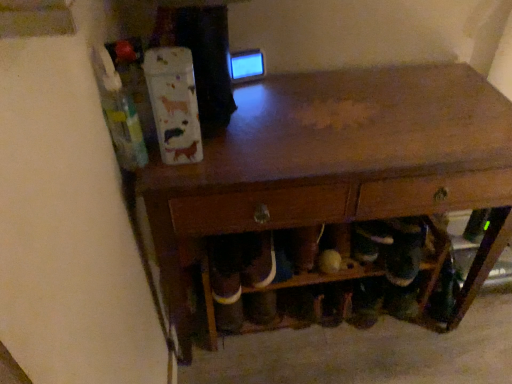
What do you see at coordinates (434, 258) in the screenshot?
I see `wooden shoe rack at lower center` at bounding box center [434, 258].

What is the approximate height of wooden shoe rack at lower center?

wooden shoe rack at lower center is 16.55 inches tall.

At what (x,y) coordinates should I click in order to perform the action: click on wooden shoe rack at lower center. Please return your answer as a coordinate pair (x, y). This screenshot has height=384, width=512. Looking at the image, I should click on (434, 258).

Describe the element at coordinates (339, 164) in the screenshot. I see `wooden table at center` at that location.

What is the approximate width of wooden table at center?

19.31 inches.

At what (x,y) coordinates should I click in order to perform the action: click on wooden table at center. Please return your answer as a coordinate pair (x, y). Looking at the image, I should click on (339, 164).

Locate an element on the screen. This screenshot has height=384, width=512. wooden shoe rack at lower center is located at coordinates (434, 258).

Looking at this image, does wooden table at center appear on the left side of wooden shoe rack at lower center?

In fact, wooden table at center is to the right of wooden shoe rack at lower center.

Is wooden table at center in front of or behind wooden shoe rack at lower center in the image?

Visually, wooden table at center is located in front of wooden shoe rack at lower center.

Between point (503, 233) and point (251, 291), which one is positioned behind?

Point (251, 291)

From the image's perspective, is wooden table at center positioned above or below wooden shoe rack at lower center?

Clearly, from the image's perspective, wooden table at center is above wooden shoe rack at lower center.

From a real-world perspective, is wooden table at center located beneath wooden shoe rack at lower center?

Actually, wooden table at center is physically above wooden shoe rack at lower center in the real world.

Looking at this image, considering the sizes of objects wooden table at center and wooden shoe rack at lower center in the image provided, who is wider, wooden table at center or wooden shoe rack at lower center?

Wider between the two is wooden table at center.

Which of these two, wooden table at center or wooden shoe rack at lower center, stands shorter?

Standing shorter between the two is wooden shoe rack at lower center.

Does wooden table at center have a larger size compared to wooden shoe rack at lower center?

Yes.

Is wooden table at center completely or partially outside of wooden shoe rack at lower center?

No, wooden table at center is inside or overlapping with wooden shoe rack at lower center.

Is wooden table at center with wooden shoe rack at lower center?

There is a gap between wooden table at center and wooden shoe rack at lower center.

Is wooden table at center facing towards wooden shoe rack at lower center?

Yes, wooden table at center is facing wooden shoe rack at lower center.

Can you tell me how much wooden table at center and wooden shoe rack at lower center differ in facing direction?

They differ by 1.96 degrees in their facing directions.

Measure the distance between wooden table at center and wooden shoe rack at lower center.

31.65 centimeters.

I want to click on shelf located underneath the wooden table at center (from a real-world perspective), so click(434, 258).

Does wooden shoe rack at lower center appear on the left side of wooden table at center?

Correct, you'll find wooden shoe rack at lower center to the left of wooden table at center.

In the image, is wooden shoe rack at lower center positioned in front of or behind wooden table at center?

wooden shoe rack at lower center is positioned farther from the viewer than wooden table at center.

Which is closer to the camera, (212, 346) or (468, 147)?

The point (468, 147) is in front.

From the image's perspective, is wooden shoe rack at lower center above or below wooden table at center?

Based on their image positions, wooden shoe rack at lower center is located beneath wooden table at center.

From a real-world perspective, is wooden shoe rack at lower center positioned under wooden table at center based on gravity?

Yes.

Is wooden shoe rack at lower center wider than wooden table at center?

In fact, wooden shoe rack at lower center might be narrower than wooden table at center.

Is wooden shoe rack at lower center taller or shorter than wooden table at center?

In the image, wooden shoe rack at lower center appears to be shorter than wooden table at center.

Does wooden shoe rack at lower center have a larger size compared to wooden table at center?

Incorrect, wooden shoe rack at lower center is not larger than wooden table at center.

Would you say wooden shoe rack at lower center is inside or outside wooden table at center?

wooden shoe rack at lower center can be found inside wooden table at center.

Does wooden shoe rack at lower center touch wooden table at center?

No, wooden shoe rack at lower center is not beside wooden table at center.

Is wooden shoe rack at lower center looking in the opposite direction of wooden table at center?

Absolutely, wooden shoe rack at lower center is directed away from wooden table at center.

How different are the orientations of wooden shoe rack at lower center and wooden table at center in degrees?

1.96 degrees separate the facing orientations of wooden shoe rack at lower center and wooden table at center.

Identify the location of shelf behind the wooden table at center. The width and height of the screenshot is (512, 384). (434, 258).

Locate an element on the screen. The height and width of the screenshot is (384, 512). shelf below the wooden table at center (from the image's perspective) is located at coordinates (434, 258).

Find the location of a particular element. The image size is (512, 384). shelf on the left of the wooden table at center is located at coordinates (434, 258).